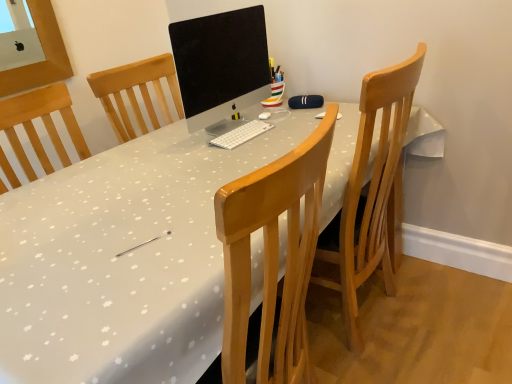
This screenshot has height=384, width=512. What do you see at coordinates (374, 191) in the screenshot? I see `light brown wooden chair at center` at bounding box center [374, 191].

You are a GUI agent. You are given a task and a screenshot of the screen. Output one action in this format:
    pyautogui.click(x=<x>, y=<y>)
    Task: Click on the matte black monitor at center
    The height and width of the screenshot is (384, 512).
    Given the screenshot: What is the action you would take?
    pyautogui.click(x=221, y=64)

Locate an element on the screen. white glossy desk at center is located at coordinates (124, 259).

Identify the location of light brown wooden chair at center. The width and height of the screenshot is (512, 384). (374, 191).

Considering the sizes of light brown wooden chair at center and white glossy desk at center in the image, is light brown wooden chair at center wider or thinner than white glossy desk at center?

In the image, light brown wooden chair at center appears to be more narrow than white glossy desk at center.

Is light brown wooden chair at center at the right side of white glossy desk at center?

Yes.

Is light brown wooden chair at center situated inside white glossy desk at center or outside?

light brown wooden chair at center exists entirely within white glossy desk at center.

From their relative heights in the image, would you say white glossy desk at center is taller or shorter than light brown wooden chair at center?

Clearly, white glossy desk at center is shorter compared to light brown wooden chair at center.

Is light brown wooden chair at center located within white glossy desk at center?

Yes, light brown wooden chair at center can be found within white glossy desk at center.

Based on the photo, does white glossy desk at center lie behind light brown wooden chair at center?

No, it is in front of light brown wooden chair at center.

Would you say white glossy desk at center is a long distance from light brown wooden chair at center?

No, white glossy desk at center is not far from light brown wooden chair at center.

Is matte black monitor at center at the left side of light brown wooden chair at center?

Indeed, matte black monitor at center is positioned on the left side of light brown wooden chair at center.

Which is in front, point (198, 110) or point (385, 85)?

Point (385, 85)

Could you tell me if matte black monitor at center is turned towards light brown wooden chair at center?

Yes, matte black monitor at center is facing light brown wooden chair at center.

Considering the relative sizes of matte black monitor at center and white glossy desk at center in the image provided, is matte black monitor at center shorter than white glossy desk at center?

Yes, matte black monitor at center is shorter than white glossy desk at center.

From the picture: Is matte black monitor at center aimed at white glossy desk at center?

No.

Which object is positioned more to the left, matte black monitor at center or white glossy desk at center?

white glossy desk at center is more to the left.

Is matte black monitor at center positioned before white glossy desk at center?

No, matte black monitor at center is further to the viewer.

Between point (341, 277) and point (251, 47), which one is positioned in front?

Positioned in front is point (341, 277).

Identify the location of computer monitor behind the light brown wooden chair at center. Image resolution: width=512 pixels, height=384 pixels. (221, 64).

From a real-world perspective, is light brown wooden chair at center physically located above or below matte black monitor at center?

From a real-world perspective, light brown wooden chair at center is physically below matte black monitor at center.

Find the location of a particular element. This screenshot has height=384, width=512. computer monitor that is above the white glossy desk at center (from a real-world perspective) is located at coordinates (221, 64).

Considering the positions of objects white glossy desk at center and matte black monitor at center in the image provided, who is more to the left, white glossy desk at center or matte black monitor at center?

white glossy desk at center.

Considering the sizes of objects white glossy desk at center and matte black monitor at center in the image provided, who is wider, white glossy desk at center or matte black monitor at center?

white glossy desk at center.

Is white glossy desk at center taller or shorter than matte black monitor at center?

Clearly, white glossy desk at center is taller compared to matte black monitor at center.

Identify the location of chair on the right of the white glossy desk at center. The width and height of the screenshot is (512, 384). (374, 191).

You are a GUI agent. You are given a task and a screenshot of the screen. Output one action in this format:
    pyautogui.click(x=<x>, y=<y>)
    Task: Click on the desk located below the light brown wooden chair at center (from the image's perspective)
    The height and width of the screenshot is (384, 512).
    Given the screenshot: What is the action you would take?
    pyautogui.click(x=124, y=259)

Considering their positions, is light brown wooden chair at center positioned further to matte black monitor at center than white glossy desk at center?

light brown wooden chair at center is further to matte black monitor at center.

Looking at the image, which one is located closer to white glossy desk at center, matte black monitor at center or light brown wooden chair at center?

matte black monitor at center.

Based on the photo, from the image, which object appears to be nearer to matte black monitor at center, white glossy desk at center or light brown wooden chair at center?

white glossy desk at center is positioned closer to the anchor matte black monitor at center.

From the image, which object appears to be farther from white glossy desk at center, light brown wooden chair at center or matte black monitor at center?

light brown wooden chair at center.

Considering their positions, is white glossy desk at center positioned further to light brown wooden chair at center than matte black monitor at center?

matte black monitor at center is positioned further to the anchor light brown wooden chair at center.

From the image, which object appears to be nearer to light brown wooden chair at center, matte black monitor at center or white glossy desk at center?

white glossy desk at center is positioned closer to the anchor light brown wooden chair at center.

The image size is (512, 384). What are the coordinates of `chair between white glossy desk at center and matte black monitor at center along the z-axis` in the screenshot? It's located at (374, 191).